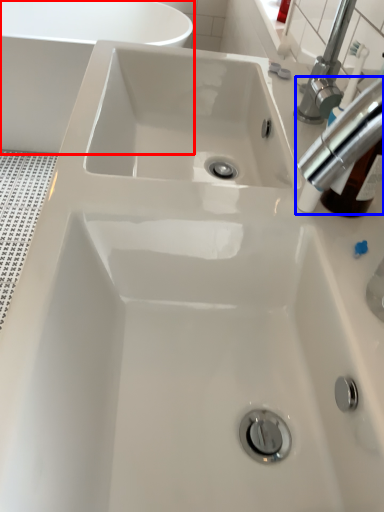
Question: Which object is further to the camera taking this photo, bath (highlighted by a red box) or tap (highlighted by a blue box)?

Choices:
 (A) bath
 (B) tap

Answer: (A)